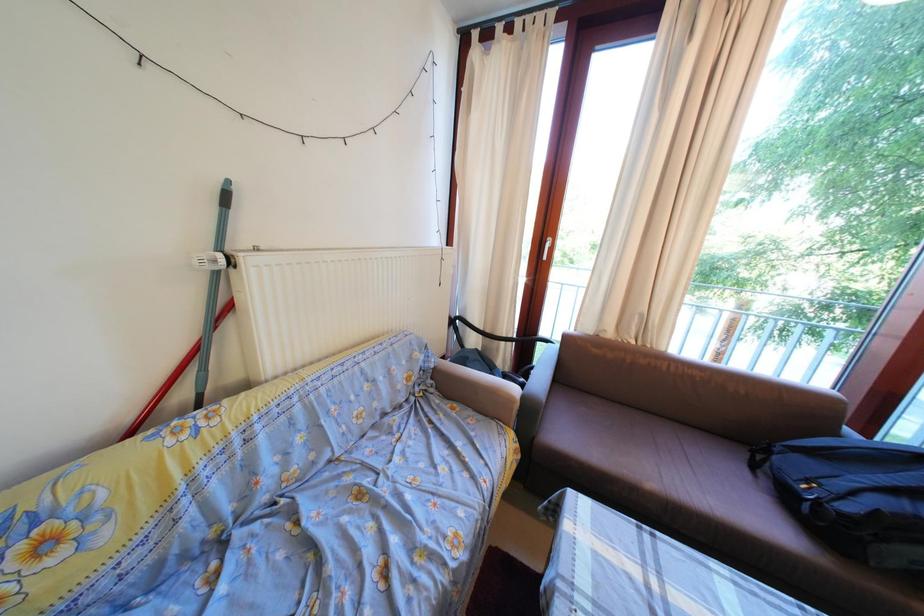
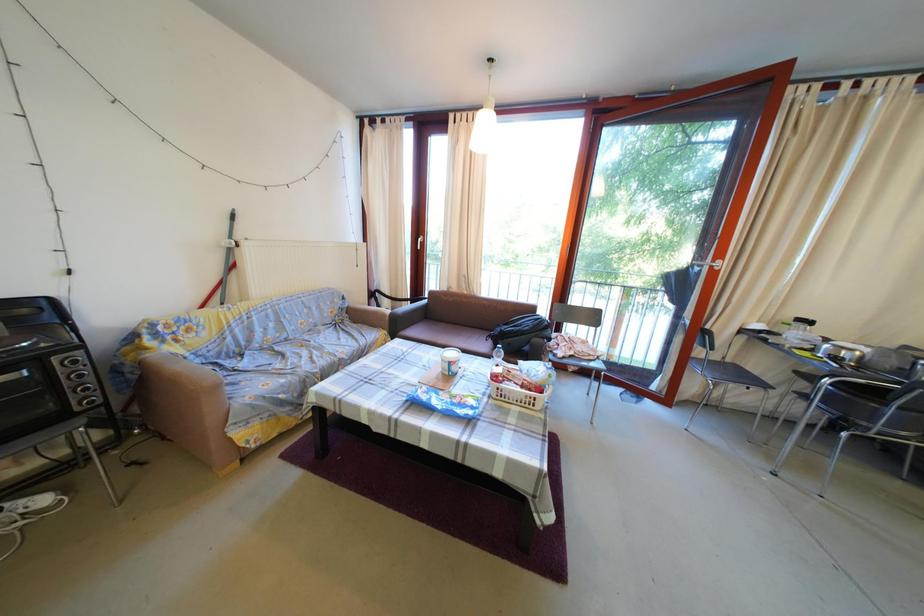
Which direction would the cameraman need to move to produce the second image?

The movement direction of the cameraman is right, backward.